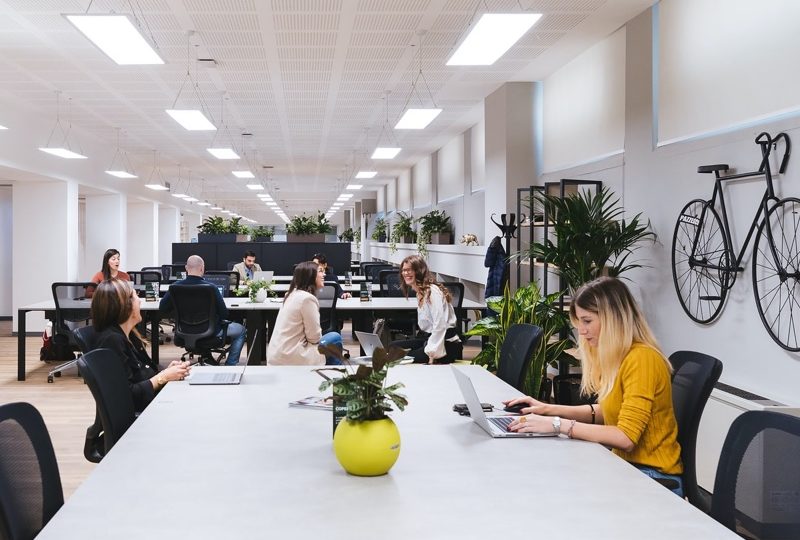
Identify the location of chairs at front table. The image size is (800, 540). (764, 469), (693, 381), (509, 352), (106, 404), (86, 332), (21, 470).